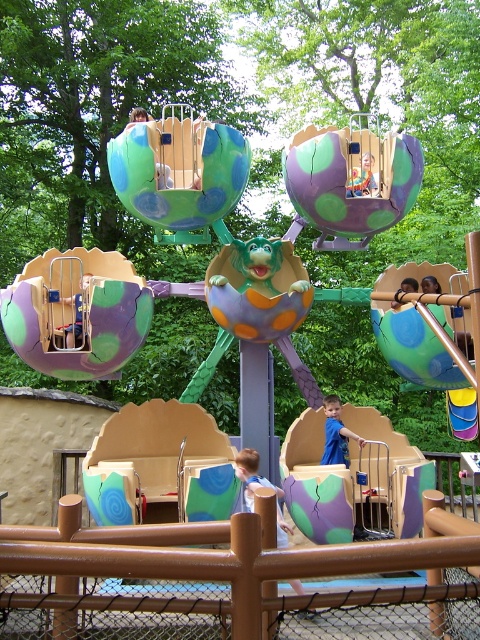
Can you confirm if matte purple slide at center is taller than blue fabric shirt at lower center?

Yes, matte purple slide at center is taller than blue fabric shirt at lower center.

Can you confirm if matte purple slide at center is shorter than blue fabric shirt at lower center?

No, matte purple slide at center is not shorter than blue fabric shirt at lower center.

Which is in front, point (312, 515) or point (334, 429)?

Positioned in front is point (312, 515).

Find the location of a particular element. The width and height of the screenshot is (480, 640). matte purple slide at center is located at coordinates (354, 480).

Which is below, light brown wooden bench at lower center or blue fabric shirt at lower center?

light brown wooden bench at lower center

How distant is light brown wooden bench at lower center from blue fabric shirt at lower center?

light brown wooden bench at lower center is 39.06 inches from blue fabric shirt at lower center.

Is point (247, 449) positioned behind point (324, 460)?

No, it is not.

Find the location of a particular element. This screenshot has height=640, width=480. light brown wooden bench at lower center is located at coordinates (260, 486).

Is matte purple slide at center further to camera compared to light brown wooden bench at lower center?

Yes, it is.

Describe the element at coordinates (354, 480) in the screenshot. I see `matte purple slide at center` at that location.

Who is more distant from viewer, [336,497] or [249,468]?

Point [249,468]

The height and width of the screenshot is (640, 480). Identify the location of matte purple slide at center. (354, 480).